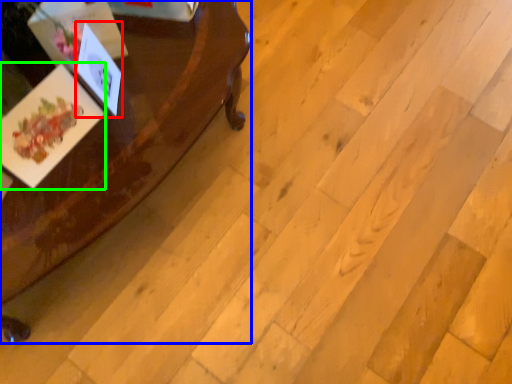
Question: Estimate the real-world distances between objects in this image. Which object is farther from postcard (highlighted by a red box), table (highlighted by a blue box) or postcard (highlighted by a green box)?

Choices:
 (A) table
 (B) postcard

Answer: (A)